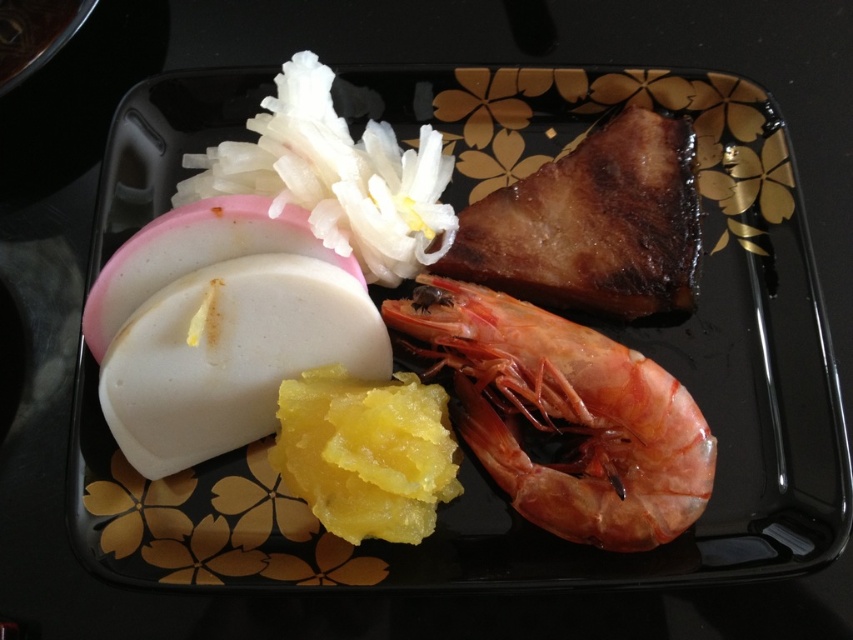
Question: Which object appears closest to the camera in this image?

Choices:
 (A) white creamy cheese at center-left
 (B) shiny red prawn at center

Answer: (B)

Question: Does shiny red prawn at center have a greater width compared to white creamy cheese at center-left?

Choices:
 (A) yes
 (B) no

Answer: (A)

Question: Which object is the closest to the brown glazed meat at upper right?

Choices:
 (A) white creamy cheese at center-left
 (B) shiny red prawn at center

Answer: (B)

Question: Can you confirm if shiny red prawn at center is wider than brown glazed meat at upper right?

Choices:
 (A) no
 (B) yes

Answer: (B)

Question: Is shiny red prawn at center behind brown glazed meat at upper right?

Choices:
 (A) yes
 (B) no

Answer: (B)

Question: Which object is farther from the camera taking this photo?

Choices:
 (A) brown glazed meat at upper right
 (B) white creamy cheese at center-left
 (C) shiny red prawn at center

Answer: (A)